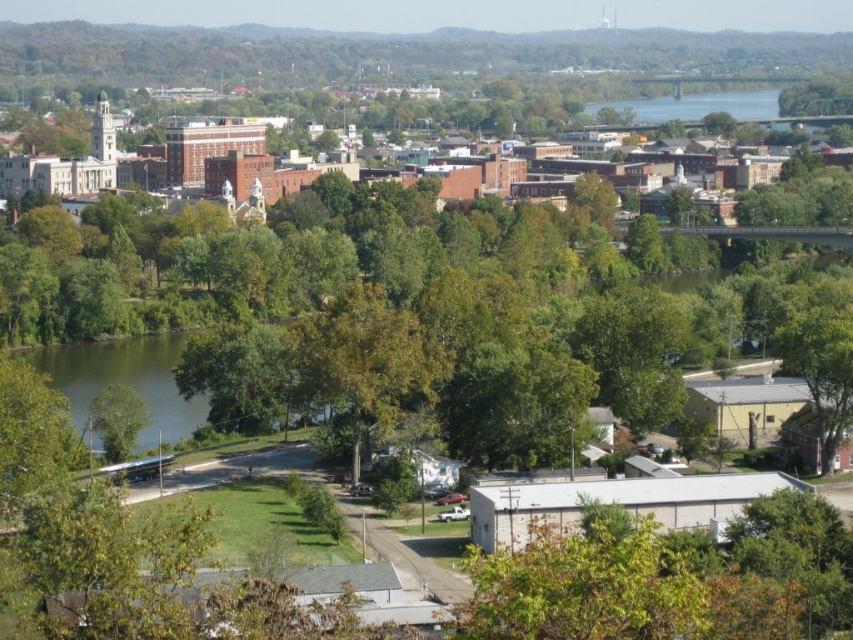
You are a landscape architect planning to plant a new tree in the town square. You observe the green leafy tree at lower right and the green leafy tree at lower left in the image. Which tree has a wider canopy, and how does this affect your planting decision?

The green leafy tree at lower right has a wider canopy than the green leafy tree at lower left. This suggests that the tree at lower right requires more space for its canopy to spread, so when planting a new tree in the town square, you should consider spacing accordingly to accommodate its broader width.

You are a city planner assessing the town layout. You need to determine if the brick building at upper left has a larger footprint than the green leafy tree at lower right. Based on the scene, can you confirm this?

The brick building at upper left might be wider than green leafy tree at lower right according to the description, so it likely has a larger footprint.

Consider the image. You are standing at the point closer to the camera in the image. Which point are you at, point (x=379, y=336) or point (x=114, y=452)?

You are at point (x=379, y=336) because it is closer to the camera than point (x=114, y=452).